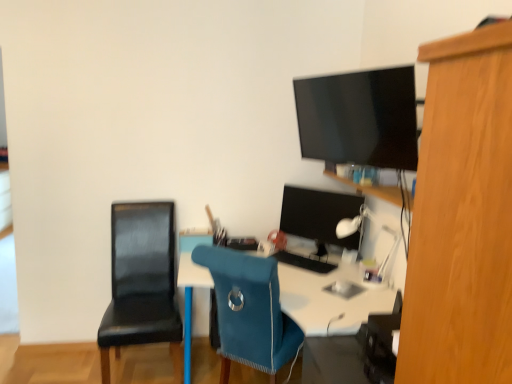
Question: Looking at their shapes, would you say matte black monitor at center is wider or thinner than black matte keyboard at center?

Choices:
 (A) wide
 (B) thin

Answer: (B)

Question: From a real-world perspective, is matte black monitor at center positioned above or below black matte keyboard at center?

Choices:
 (A) above
 (B) below

Answer: (A)

Question: Considering the real-world distances, which object is farthest from the white glossy desk at center?

Choices:
 (A) black leather chair at left, acting as the first chair starting from the left
 (B) black matte keyboard at center
 (C) blue fabric chair at center, the second chair in the left-to-right sequence
 (D) matte black monitor at center
 (E) white plastic lamp at upper right

Answer: (A)

Question: Considering the real-world distances, which object is closest to the white glossy desk at center?

Choices:
 (A) black matte keyboard at center
 (B) blue fabric chair at center, the second chair in the left-to-right sequence
 (C) matte black monitor at center
 (D) white plastic lamp at upper right
 (E) black leather chair at left, placed as the second chair when sorted from right to left

Answer: (B)